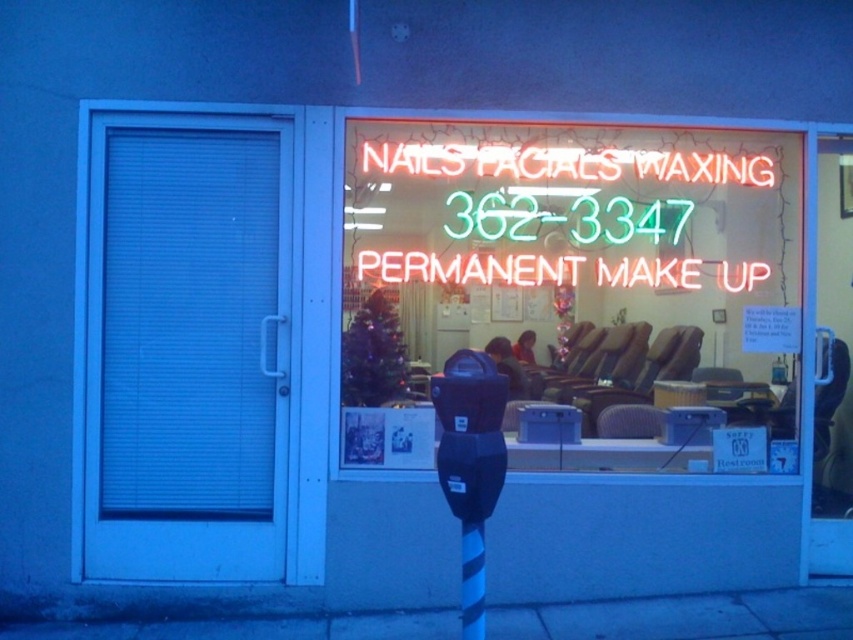
Question: Is white matte door at left thinner than black striped pole at center?

Choices:
 (A) no
 (B) yes

Answer: (A)

Question: Can you confirm if white matte door at left is positioned to the left of neontexturedsign at center?

Choices:
 (A) no
 (B) yes

Answer: (B)

Question: In this image, where is neon sign at upper center located relative to white matte door at left?

Choices:
 (A) left
 (B) right

Answer: (B)

Question: Which point is farther to the camera?

Choices:
 (A) neontexturedsign at center
 (B) black plastic parking meter at lower center
 (C) neon sign at upper center

Answer: (A)

Question: Among these points, which one is nearest to the camera?

Choices:
 (A) (495, 378)
 (B) (462, 625)
 (C) (283, 237)

Answer: (A)

Question: Considering the real-world distances, which object is farthest from the neon sign at upper center?

Choices:
 (A) white matte door at left
 (B) black plastic parking meter at lower center
 (C) neontexturedsign at center
 (D) black striped pole at center

Answer: (D)